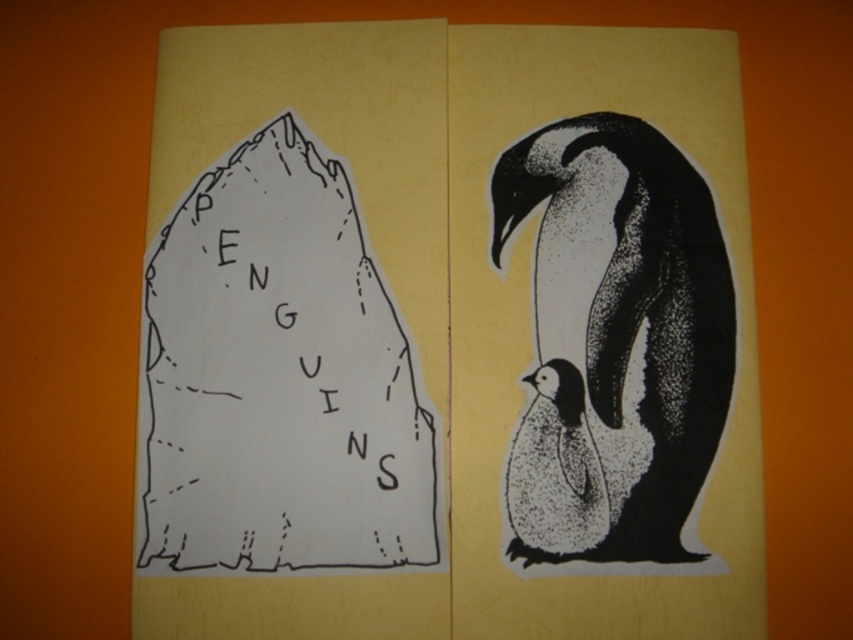
What do you see at coordinates (280, 378) in the screenshot?
I see `white paper at center` at bounding box center [280, 378].

What do you see at coordinates (280, 378) in the screenshot? The image size is (853, 640). I see `white paper at center` at bounding box center [280, 378].

Image resolution: width=853 pixels, height=640 pixels. What are the coordinates of `white paper at center` in the screenshot? It's located at (280, 378).

Does black dotted penguin at right have a lesser height compared to speckled white penguin at lower right?

In fact, black dotted penguin at right may be taller than speckled white penguin at lower right.

Between point (635, 490) and point (505, 474), which one is positioned behind?

Point (505, 474)

This screenshot has height=640, width=853. I want to click on black dotted penguin at right, so click(x=614, y=346).

Can you confirm if white paper at center is shorter than speckled white penguin at lower right?

No.

Which is below, white paper at center or speckled white penguin at lower right?

speckled white penguin at lower right is below.

Which is in front, point (190, 358) or point (541, 481)?

Positioned in front is point (541, 481).

Where is `white paper at center`? The height and width of the screenshot is (640, 853). white paper at center is located at coordinates (280, 378).